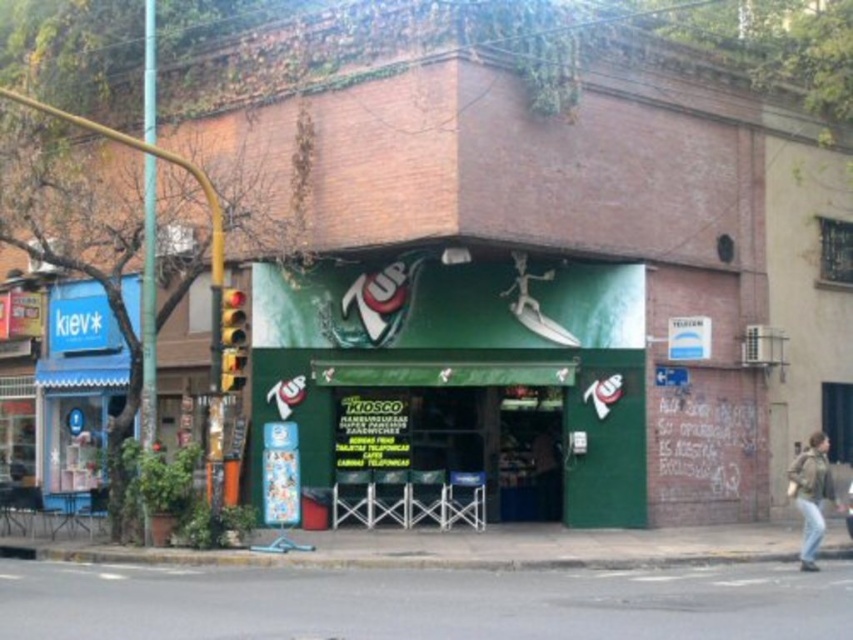
Which is more to the left, green matte signboard at center or light brown leather jacket at lower right?

Positioned to the left is green matte signboard at center.

Can you confirm if green matte signboard at center is bigger than light brown leather jacket at lower right?

No.

Who is more forward, (341, 362) or (849, 488)?

Point (341, 362) is more forward.

Locate an element on the screen. green matte signboard at center is located at coordinates (461, 372).

Does green matte signboard at center have a lesser width compared to green leather jacket at lower right?

In fact, green matte signboard at center might be wider than green leather jacket at lower right.

This screenshot has width=853, height=640. I want to click on green matte signboard at center, so click(461, 372).

Does point (827, 448) lie behind point (849, 496)?

No, it is not.

Does green leather jacket at lower right have a lesser height compared to light brown leather jacket at lower right?

Yes, green leather jacket at lower right is shorter than light brown leather jacket at lower right.

In order to click on green leather jacket at lower right in this screenshot , I will do `click(811, 493)`.